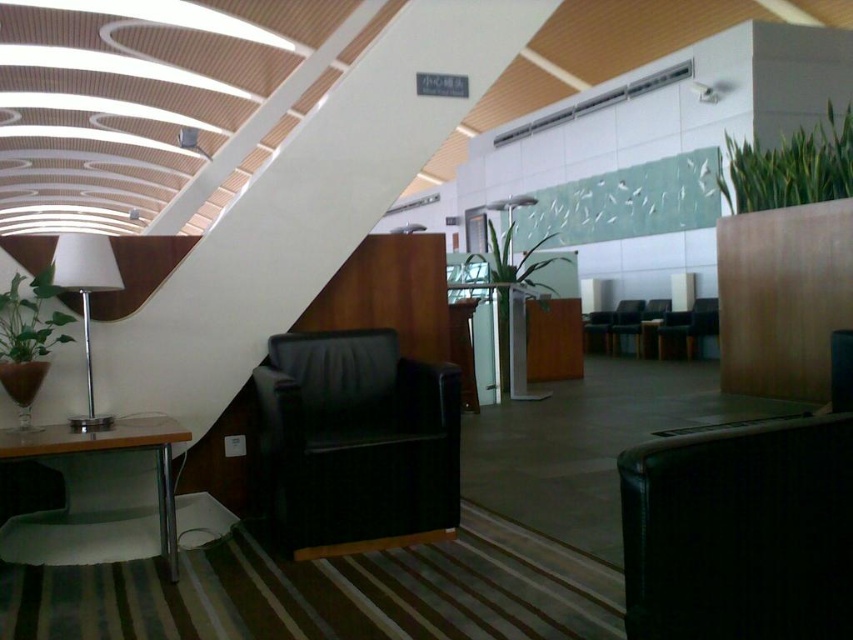
You are sitting in the black leather swivel chair at center and want to reach the green matte plant at left to water it. Can you easily reach the plant without moving from your current position?

The black leather swivel chair at center is in front of the green matte plant at left, so you can easily reach the plant without moving from your current position.

You are sitting in the black leather swivel chair at center and want to reach the green matte plant at left. Considering the size difference between the two, do you think you can easily reach the plant without moving from your seat?

The black leather swivel chair at center is larger in size than the green matte plant at left, so you can easily reach the plant without moving from your seat since the chair is bigger and provides more space to stretch towards the plant.

You are a visitor in this lounge and want to place a small decorative item between the green matte plant at left and the green leafy plant at center. Based on their positions, where should you place the item to ensure it is between them?

The green matte plant at left is below the green leafy plant at center, so placing the item between them would require positioning it horizontally between their left and right positions, as they are vertically aligned.